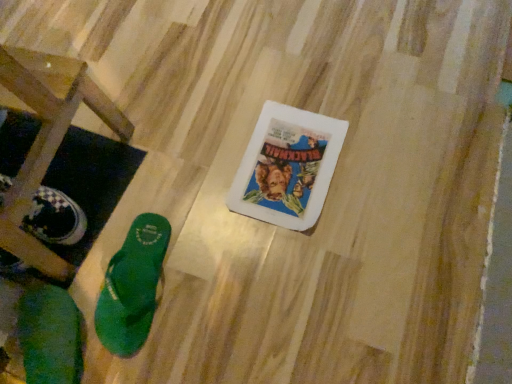
Image resolution: width=512 pixels, height=384 pixels. I want to click on vacant area that lies to the right of green rubber flip-flop at lower left, which is counted as the first footwear, starting from the right, so click(218, 269).